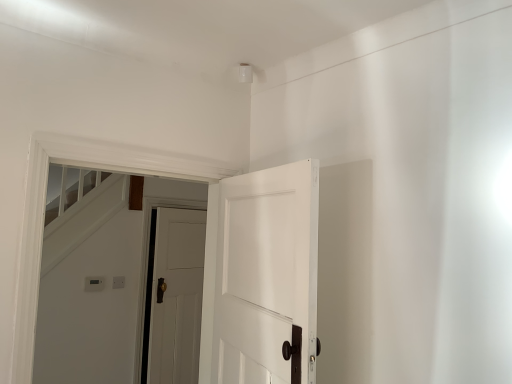
Question: In the image, is white wooden door at center, the 1th door when ordered from back to front, positioned in front of or behind white painted wood door at center, marked as the first door in a front-to-back arrangement?

Choices:
 (A) front
 (B) behind

Answer: (B)

Question: Is point (166, 380) positioned closer to the camera than point (239, 210)?

Choices:
 (A) farther
 (B) closer

Answer: (A)

Question: Is white wooden door at center, the 1th door when ordered from left to right, to the left or to the right of white painted wood door at center, positioned as the 1th door in right-to-left order, in the image?

Choices:
 (A) left
 (B) right

Answer: (A)

Question: Considering the positions of white painted wood door at center, which is the 2th door from left to right, and white wooden door at center, the 1th door when ordered from left to right, in the image, is white painted wood door at center, which is the 2th door from left to right, wider or thinner than white wooden door at center, the 1th door when ordered from left to right,?

Choices:
 (A) thin
 (B) wide

Answer: (A)

Question: Considering the relative positions of white painted wood door at center, marked as the second door in a back-to-front arrangement, and white wooden door at center, the 1th door when ordered from back to front, in the image provided, is white painted wood door at center, marked as the second door in a back-to-front arrangement, to the left or to the right of white wooden door at center, the 1th door when ordered from back to front,?

Choices:
 (A) left
 (B) right

Answer: (B)

Question: Considering the positions of white painted wood door at center, marked as the second door in a back-to-front arrangement, and white wooden door at center, the 1th door when ordered from back to front, in the image, is white painted wood door at center, marked as the second door in a back-to-front arrangement, bigger or smaller than white wooden door at center, the 1th door when ordered from back to front,?

Choices:
 (A) big
 (B) small

Answer: (A)

Question: Considering the positions of point (240, 276) and point (180, 327), is point (240, 276) closer or farther from the camera than point (180, 327)?

Choices:
 (A) closer
 (B) farther

Answer: (A)